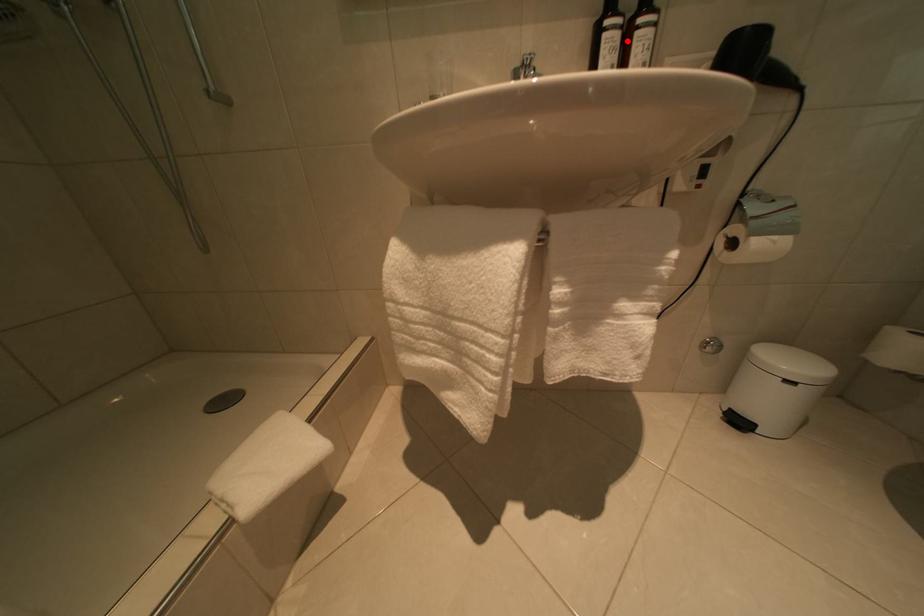
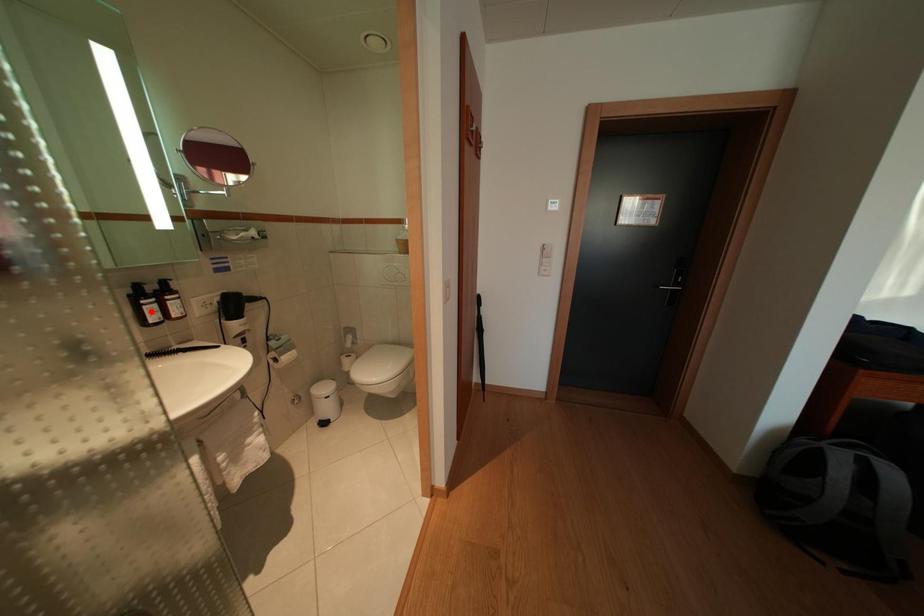
I am providing you with two images of the same scene from different viewpoints. A red point is marked on the first image and another point is marked on the second image. Does the point marked in image1 correspond to the same location as the one in image2?

No